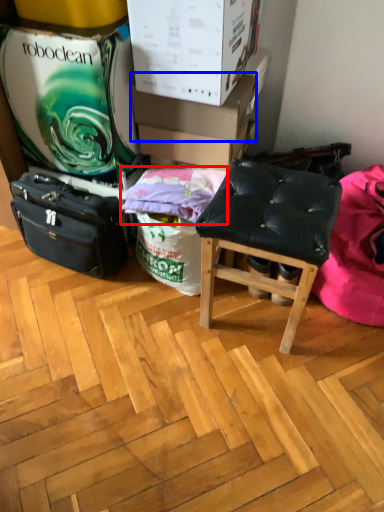
Question: Among these objects, which one is nearest to the camera, pillow (highlighted by a red box) or cardboard box (highlighted by a blue box)?

Choices:
 (A) pillow
 (B) cardboard box

Answer: (A)